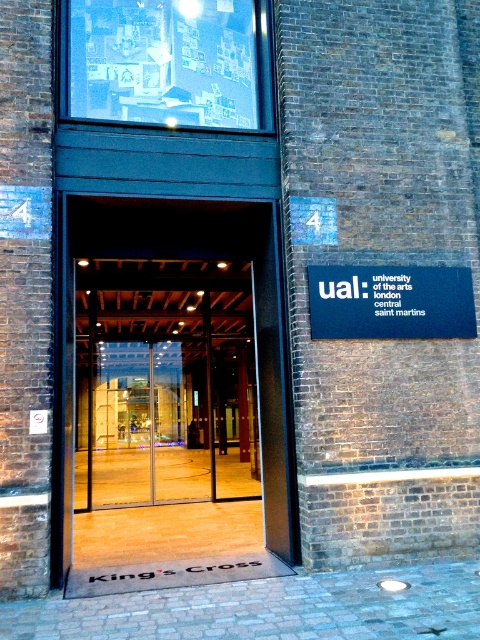
Is transparent glass door at center shorter than blue matte sign at center?

Incorrect, transparent glass door at center's height does not fall short of blue matte sign at center's.

Is the position of transparent glass door at center less distant than that of blue matte sign at center?

Yes, it is in front of blue matte sign at center.

Does point (106, 224) come farther from viewer compared to point (425, 305)?

Yes, it is behind point (425, 305).

This screenshot has width=480, height=640. Find the location of `transparent glass door at center`. transparent glass door at center is located at coordinates (178, 381).